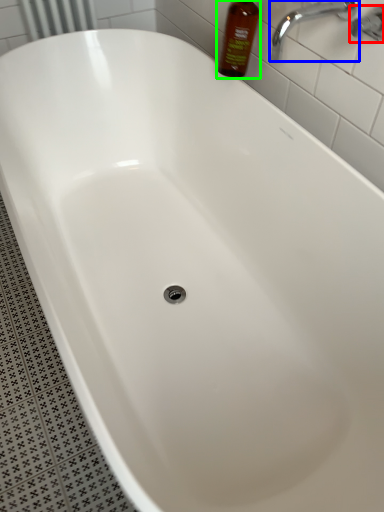
Question: Which object is positioned closest to plumbing fixture (highlighted by a red box)? Select from tap (highlighted by a blue box) and bottle (highlighted by a green box).

Choices:
 (A) tap
 (B) bottle

Answer: (A)